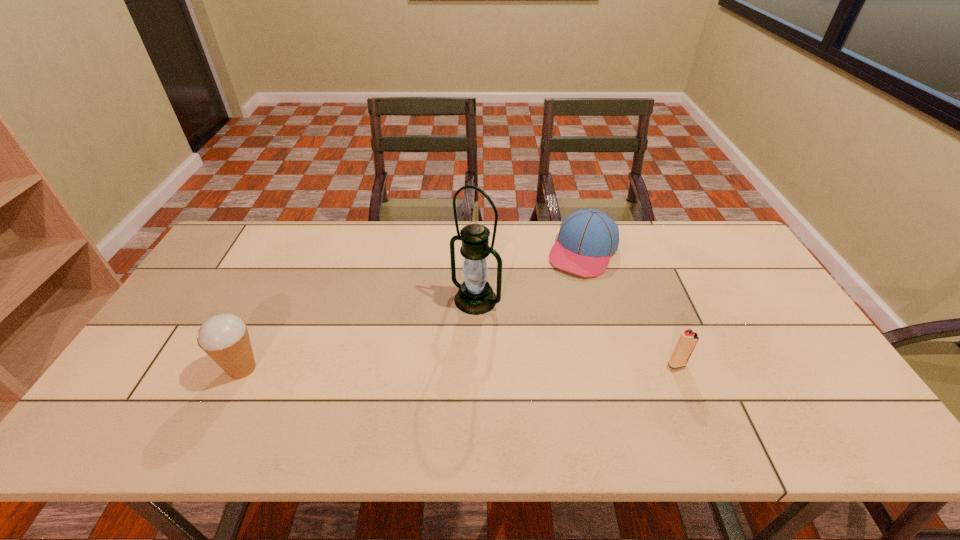
Locate an element on the screen. vacant space at the far left corner of the desktop is located at coordinates coord(243,221).

This screenshot has width=960, height=540. In order to click on vacant space in between the baseball cap and the rightmost object in this screenshot , I will do `click(630, 308)`.

You are a GUI agent. You are given a task and a screenshot of the screen. Output one action in this format:
    pyautogui.click(x=<x>, y=<y>)
    Task: Click on the free space between the igniter and the leftmost object
    
    Given the screenshot: What is the action you would take?
    pyautogui.click(x=460, y=366)

The image size is (960, 540). Identify the location of vacant space in between the rightmost object and the second tallest object. (460, 366).

Find the location of `free space between the leftmost object and the second farthest object`. free space between the leftmost object and the second farthest object is located at coordinates (359, 334).

Locate an element on the screen. Image resolution: width=960 pixels, height=540 pixels. vacant point located between the farthest object and the igniter is located at coordinates (630, 308).

Where is `empty space between the farthest object and the igniter`? The image size is (960, 540). empty space between the farthest object and the igniter is located at coordinates (630, 308).

At what (x,y) coordinates should I click in order to perform the action: click on vacant area between the second object from right to left and the third object from right to left. Please return your answer as a coordinate pair (x, y). Looking at the image, I should click on (530, 275).

This screenshot has width=960, height=540. In order to click on free area in between the farthest object and the second object from left to right in this screenshot , I will do `click(530, 275)`.

Locate an element on the screen. The height and width of the screenshot is (540, 960). vacant area between the igniter and the icecream is located at coordinates (460, 366).